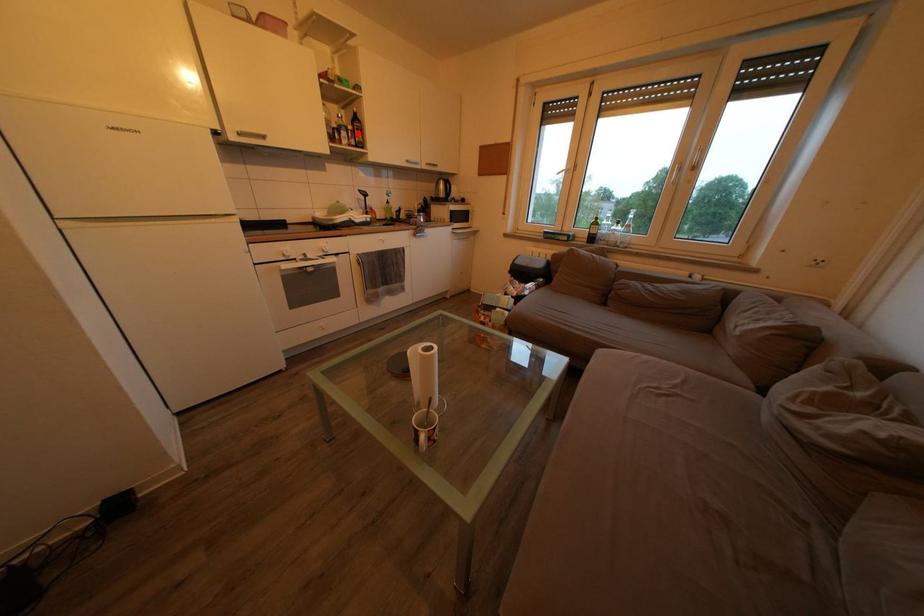
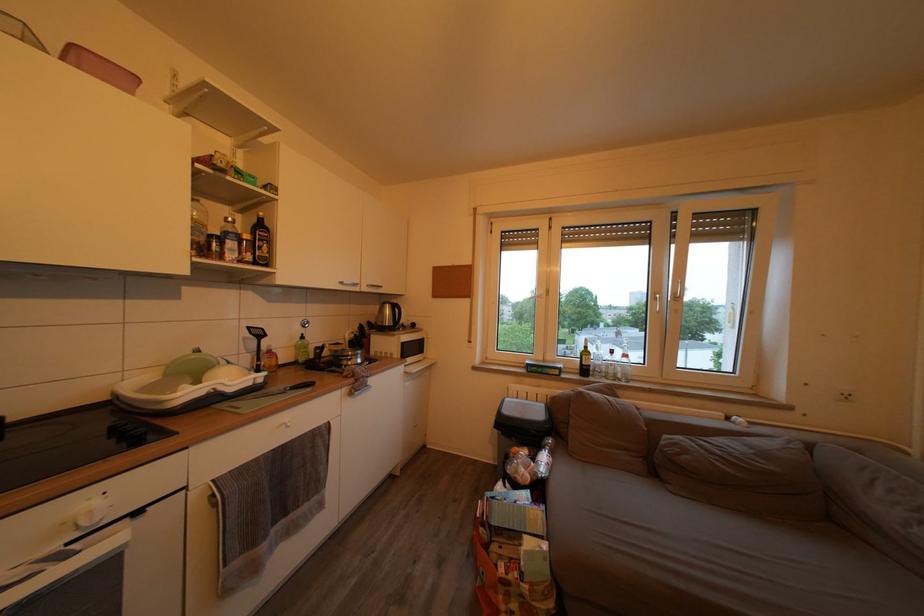
Question: I am providing you with two images of the same scene from different viewpoints. Image1 has a red point marked. In image2, the corresponding 3D location appears at what relative position? Reply with the corresponding letter.

Choices:
 (A) Closer
 (B) Farther

Answer: (B)